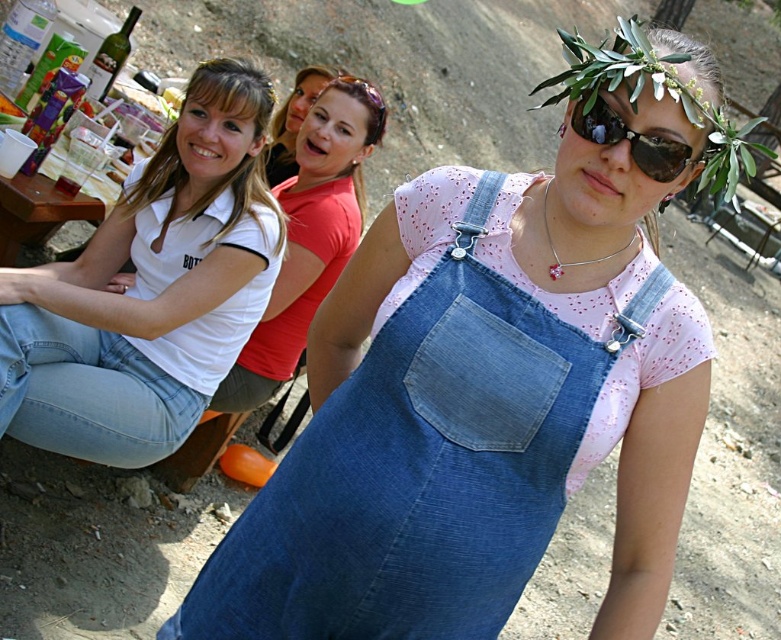
Question: In this image, where is denim overall dress at center located relative to white matte shirt at upper left?

Choices:
 (A) right
 (B) left

Answer: (A)

Question: Which object is positioned closest to the white matte shirt at upper left?

Choices:
 (A) matte red shirt at center
 (B) denim overall dress at center
 (C) white cotton shirt at upper left
 (D) denim pocket at center

Answer: (A)

Question: Which object is positioned closest to the white matte shirt at upper left?

Choices:
 (A) white cotton shirt at upper left
 (B) matte red shirt at center
 (C) denim pocket at center
 (D) denim overall dress at center

Answer: (B)

Question: From the image, what is the correct spatial relationship of denim overall dress at center in relation to matte red shirt at center?

Choices:
 (A) above
 (B) below

Answer: (B)

Question: Which object is the farthest from the matte red shirt at center?

Choices:
 (A) white cotton shirt at upper left
 (B) denim overall dress at center
 (C) sunglasses at center
 (D) white matte shirt at upper left

Answer: (C)

Question: Does denim overall dress at center appear over sunglasses at center?

Choices:
 (A) yes
 (B) no

Answer: (B)